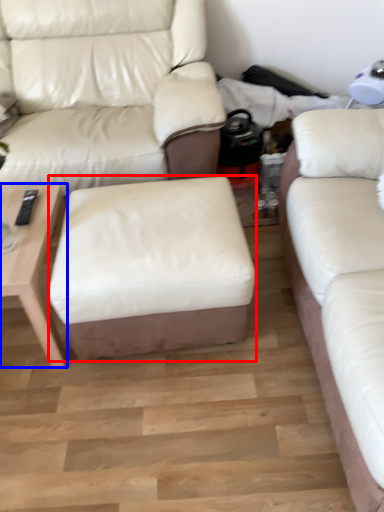
Question: Which object appears farthest to the camera in this image, stool (highlighted by a red box) or table (highlighted by a blue box)?

Choices:
 (A) stool
 (B) table

Answer: (B)